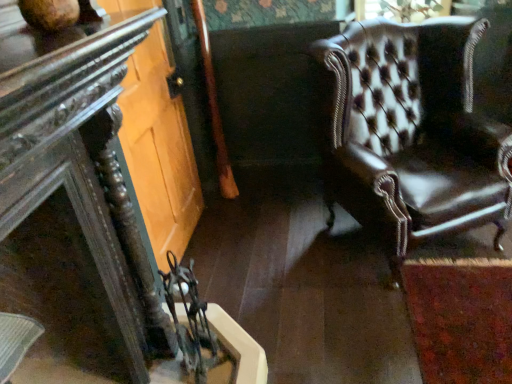
You are a GUI agent. You are given a task and a screenshot of the screen. Output one action in this format:
    pyautogui.click(x=<x>, y=<y>)
    Task: Click on the free point to the right of clear glass door at lower left
    The image size is (512, 384).
    Given the screenshot: What is the action you would take?
    pyautogui.click(x=269, y=243)